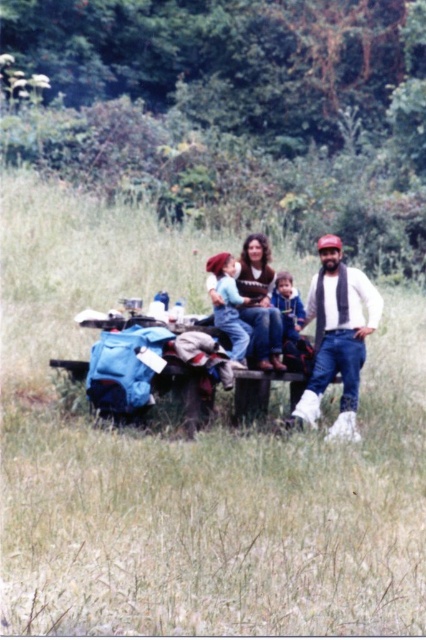
You are planning to hang a small picture frame on the wall between the white matte scarf at right and the knitted sweater at center. Since the frame is 10 cm tall, will it fit vertically between them?

The white matte scarf at right is much taller than the knitted sweater at center. The vertical space between them may accommodate the 10 cm frame, but the exact fit depends on the distance between their top and bottom edges. However, since the scarf is taller, there might be sufficient vertical clearance for the frame.

You are a photographer trying to capture a candid shot of the family picnic. You want to ensure that both the white matte scarf at right and the knitted sweater at center are in focus. If your camera has a depth of field that can cover 20 inches, will you need to adjust your focus to include both objects?

The distance between the white matte scarf at right and the knitted sweater at center is 22.07 inches. Since the camera can only cover 20 inches, you will need to adjust your focus to include both objects.